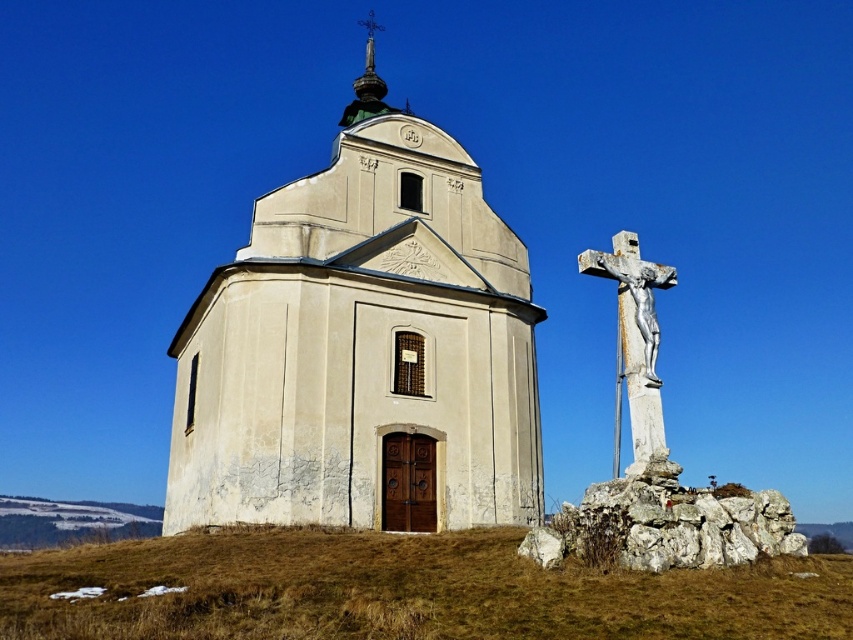
Question: Which point is farther to the camera?

Choices:
 (A) beige stone church at center
 (B) white stone crucifix at right
 (C) brown dry grass at lower center

Answer: (A)

Question: Which of the following is the closest to the observer?

Choices:
 (A) beige stone church at center
 (B) white stone crucifix at right
 (C) brown dry grass at lower center

Answer: (C)

Question: Does beige stone church at center have a lesser width compared to white stone crucifix at right?

Choices:
 (A) no
 (B) yes

Answer: (A)

Question: Does beige stone church at center have a larger size compared to brown dry grass at lower center?

Choices:
 (A) yes
 (B) no

Answer: (A)

Question: Among these objects, which one is farthest from the camera?

Choices:
 (A) white stone crucifix at right
 (B) beige stone church at center

Answer: (B)

Question: Does beige stone church at center have a larger size compared to brown dry grass at lower center?

Choices:
 (A) no
 (B) yes

Answer: (B)